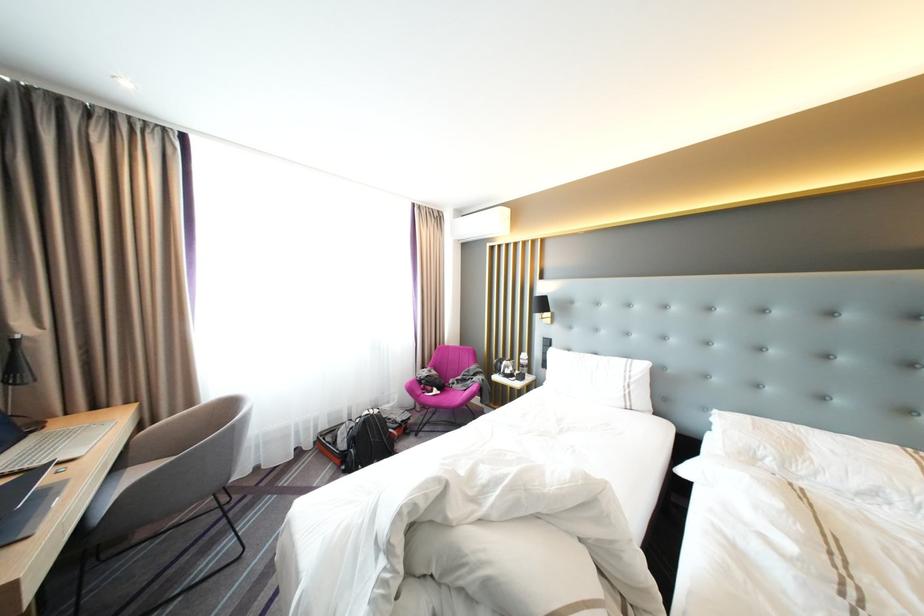
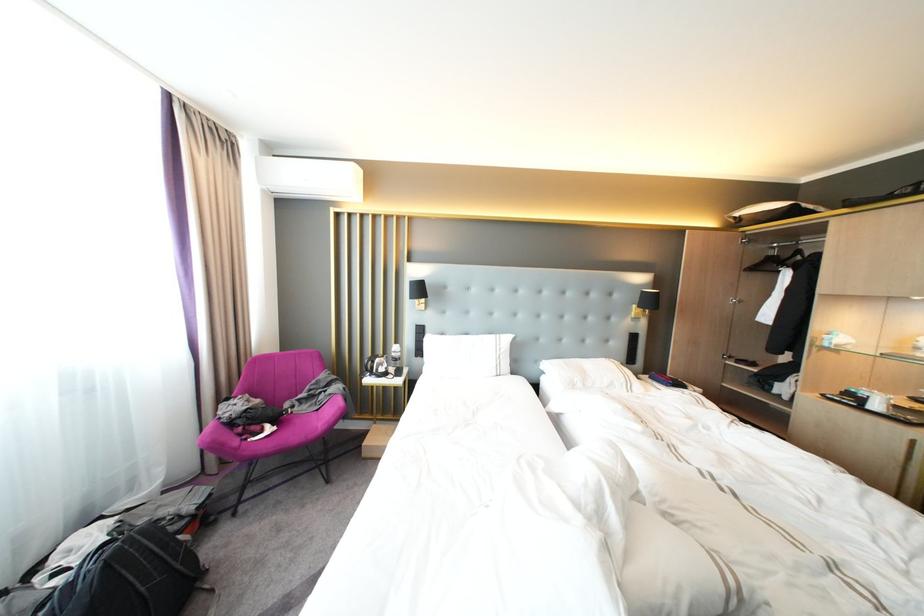
Find the pixel in the second image that matches [771,455] in the first image.

(586, 382)